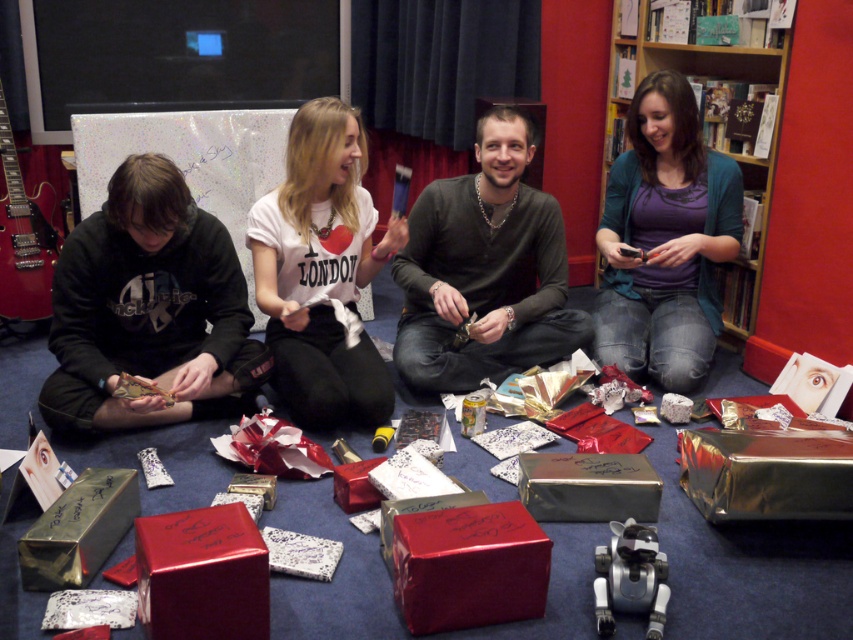
Based on the photo, you are organizing a gift exchange and need to place a gift box that requires 1 meter of space between it and the nearest wall. You have the black matte hoodie at lower left and the wooden bookshelf at upper right in the scene. Which object should you place the gift box closer to to ensure it meets the space requirement?

The black matte hoodie at lower left is to the left of the wooden bookshelf at upper right. To ensure the gift box has 1 meter of space from the nearest wall, place it closer to the black matte hoodie at lower left since it is farther from the wall compared to the wooden bookshelf at upper right.